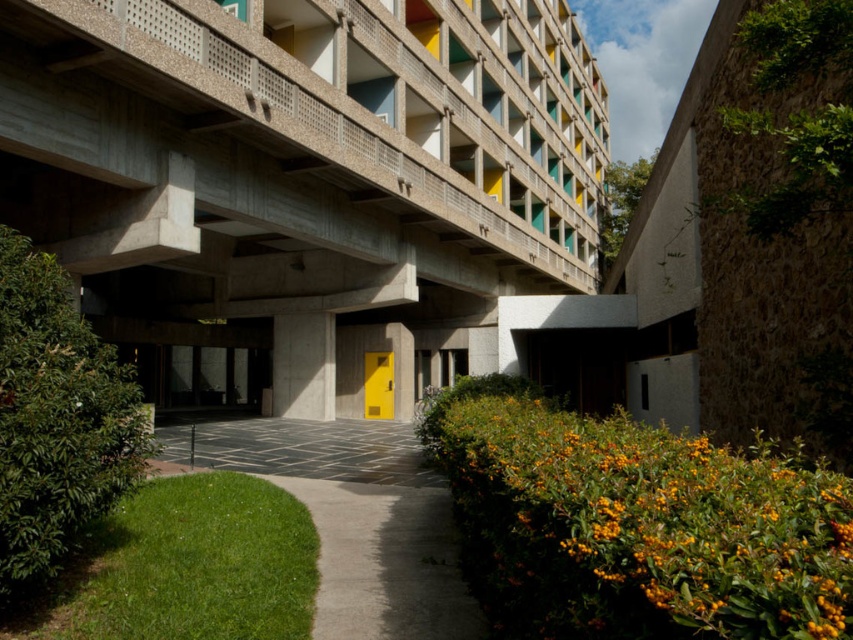
Is smooth concrete path at center to the right of concrete pillar at center from the viewer's perspective?

Indeed, smooth concrete path at center is positioned on the right side of concrete pillar at center.

Can you confirm if smooth concrete path at center is taller than concrete pillar at center?

No, smooth concrete path at center is not taller than concrete pillar at center.

Find the location of `smooth concrete path at center`. smooth concrete path at center is located at coordinates (360, 522).

Can you confirm if concrete at upper center is wider than concrete pillar at center?

Yes, concrete at upper center is wider than concrete pillar at center.

The width and height of the screenshot is (853, 640). What do you see at coordinates (374, 106) in the screenshot?
I see `concrete at upper center` at bounding box center [374, 106].

Which is behind, point (592, 262) or point (282, 397)?

The point (592, 262) is more distant.

Identify the location of concrete at upper center. (374, 106).

Who is shorter, concrete at upper center or smooth concrete path at center?

smooth concrete path at center is shorter.

Which is more to the right, concrete at upper center or smooth concrete path at center?

From the viewer's perspective, concrete at upper center appears more on the right side.

Image resolution: width=853 pixels, height=640 pixels. Describe the element at coordinates (374, 106) in the screenshot. I see `concrete at upper center` at that location.

Image resolution: width=853 pixels, height=640 pixels. Find the location of `concrete at upper center`. concrete at upper center is located at coordinates (374, 106).